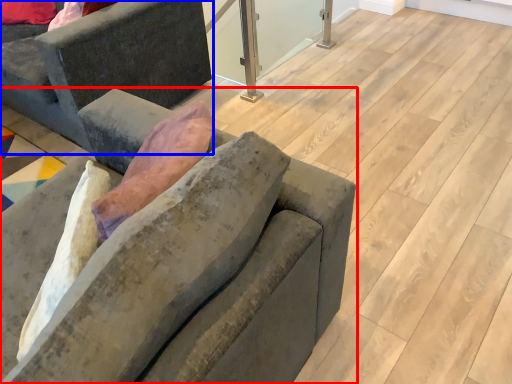
Question: Which point is closer to the camera, studio couch (highlighted by a red box) or studio couch (highlighted by a blue box)?

Choices:
 (A) studio couch
 (B) studio couch

Answer: (A)